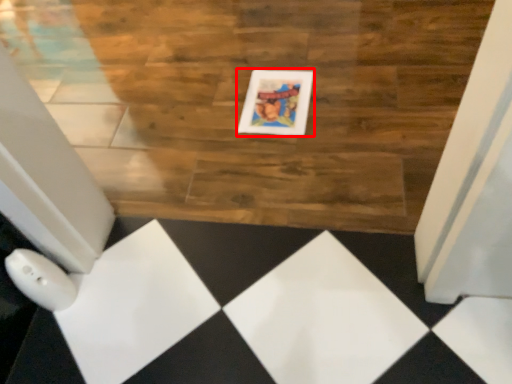
Question: Where is picture frame (annotated by the red box) located in relation to hardwood in the image?

Choices:
 (A) right
 (B) left

Answer: (A)